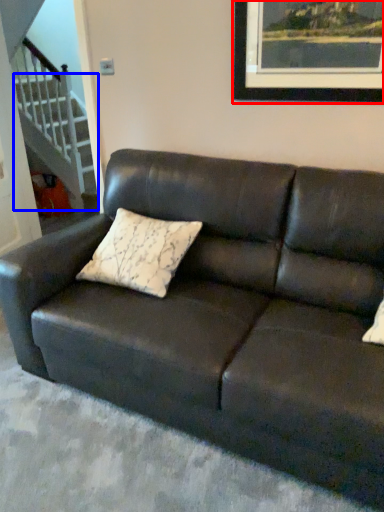
Question: Which point is closer to the camera, picture frame (highlighted by a red box) or stairwell (highlighted by a blue box)?

Choices:
 (A) picture frame
 (B) stairwell

Answer: (A)